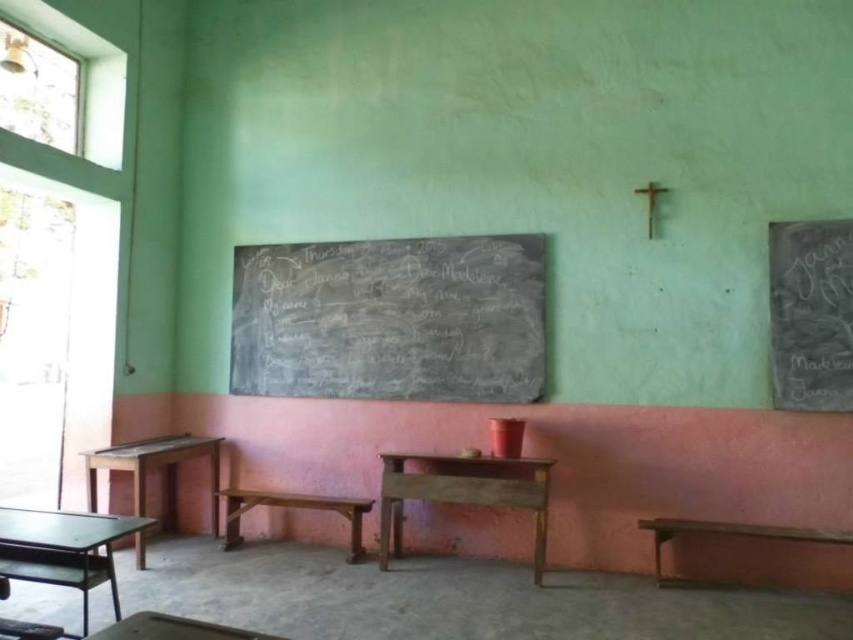
Is wooden desk at left to the left of wooden table at lower center from the viewer's perspective?

Yes, wooden desk at left is to the left of wooden table at lower center.

Which is below, wooden desk at left or wooden table at lower center?

Positioned lower is wooden desk at left.

The image size is (853, 640). Describe the element at coordinates (155, 468) in the screenshot. I see `wooden desk at left` at that location.

The height and width of the screenshot is (640, 853). Identify the location of wooden desk at left. (155, 468).

Is black chalkboard at center to the left of wooden table at center from the viewer's perspective?

Correct, you'll find black chalkboard at center to the left of wooden table at center.

The width and height of the screenshot is (853, 640). In order to click on black chalkboard at center in this screenshot , I will do `click(392, 317)`.

Is black chalkboard at center to the left of wooden stool at center from the viewer's perspective?

In fact, black chalkboard at center is to the right of wooden stool at center.

The height and width of the screenshot is (640, 853). Describe the element at coordinates (392, 317) in the screenshot. I see `black chalkboard at center` at that location.

You are a GUI agent. You are given a task and a screenshot of the screen. Output one action in this format:
    pyautogui.click(x=<x>, y=<y>)
    Task: Click on the black chalkboard at center
    This screenshot has width=853, height=640.
    Given the screenshot: What is the action you would take?
    pyautogui.click(x=392, y=317)